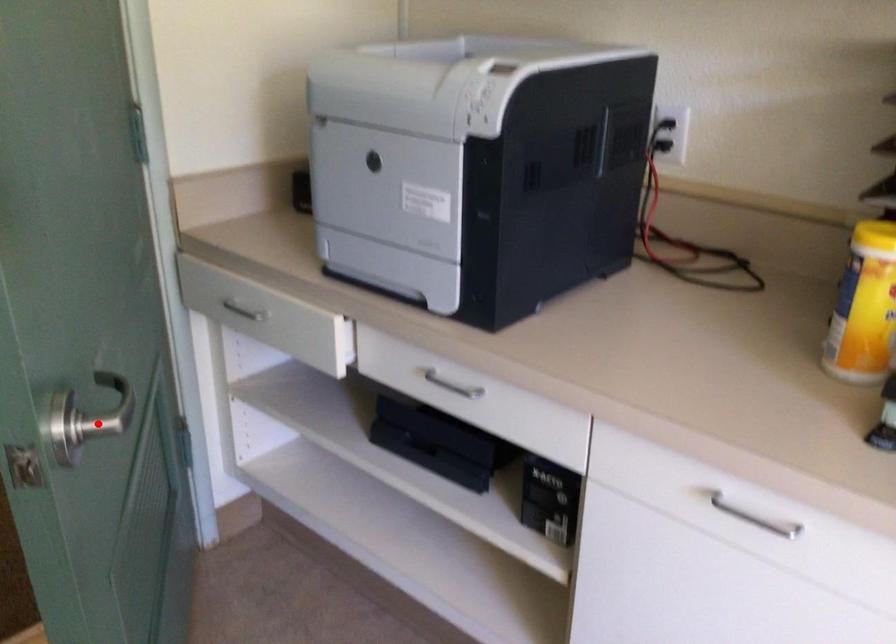
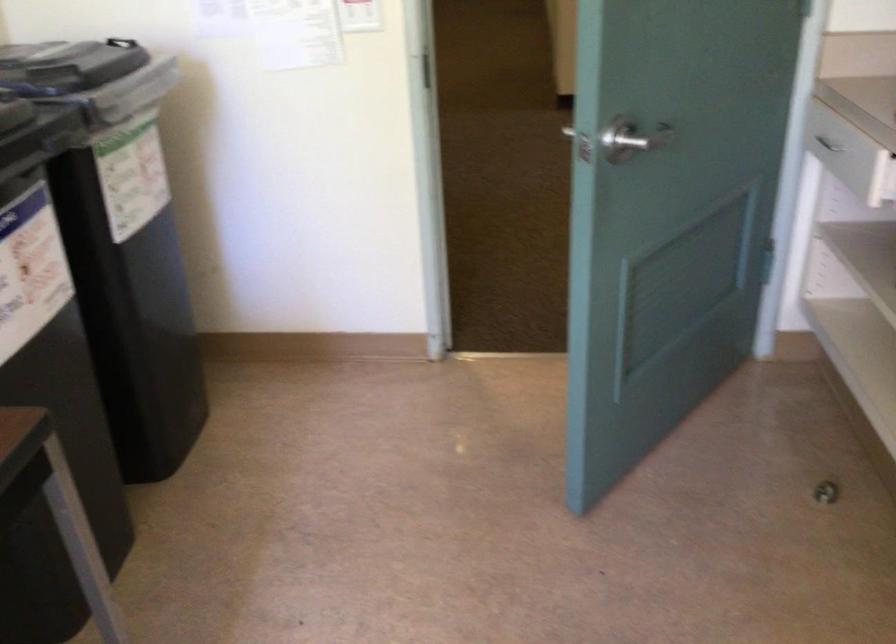
Where in the second image is the point corresponding to the highlighted location from the first image?

(633, 138)